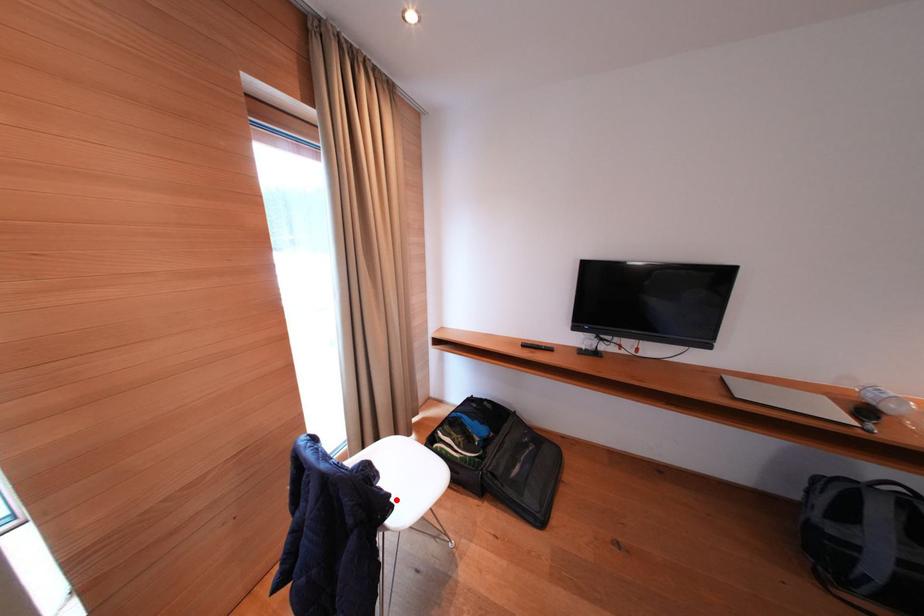
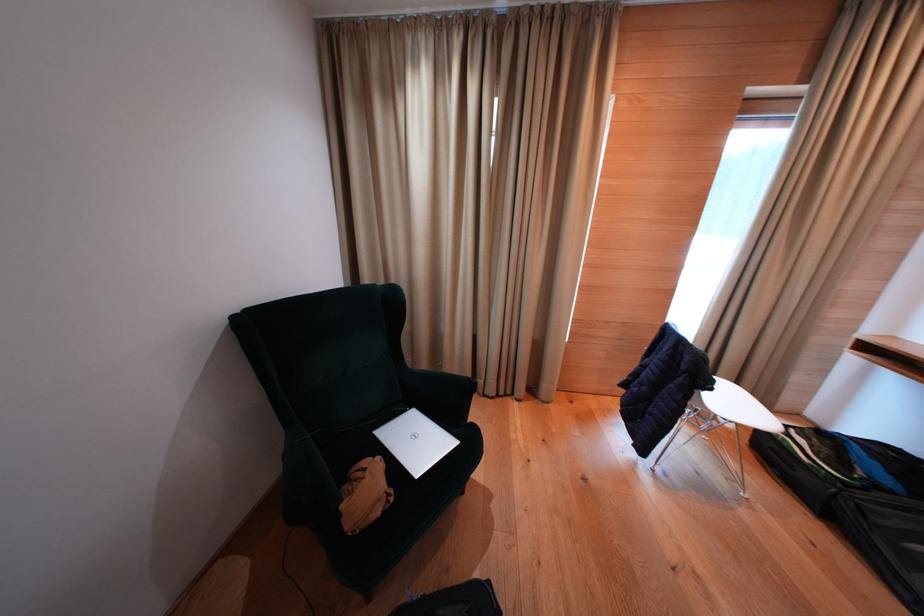
Question: I am providing you with two images of the same scene from different viewpoints. A red point is marked on the first image. Can you still see the location of the red point in image 2?

Choices:
 (A) Yes
 (B) No

Answer: (B)